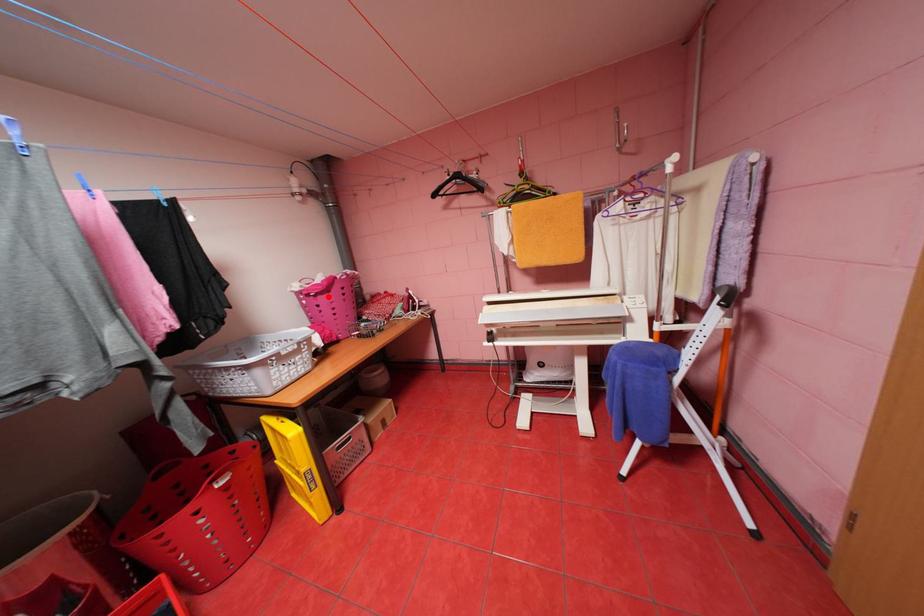
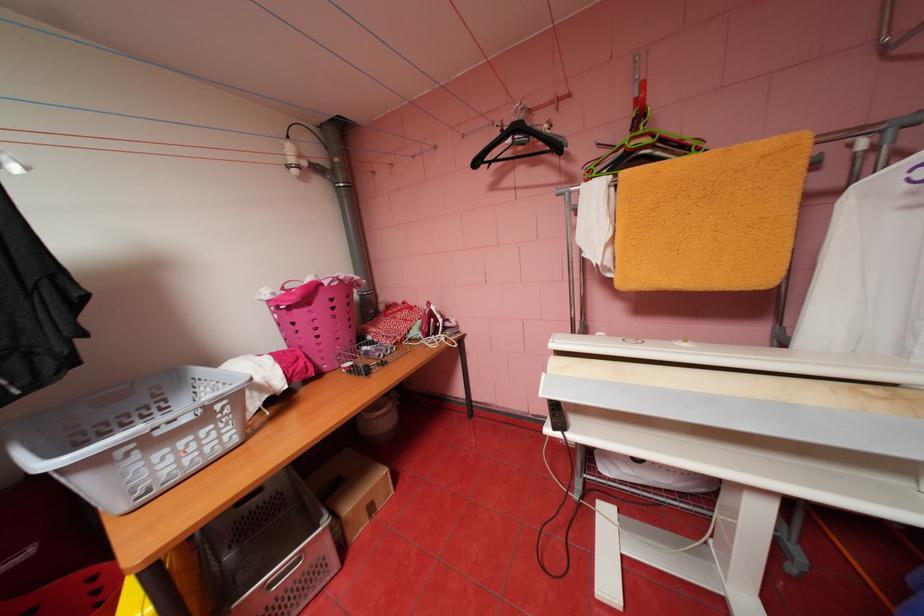
Find the pixel in the second image that matches the highlighted location in the first image.

(304, 310)